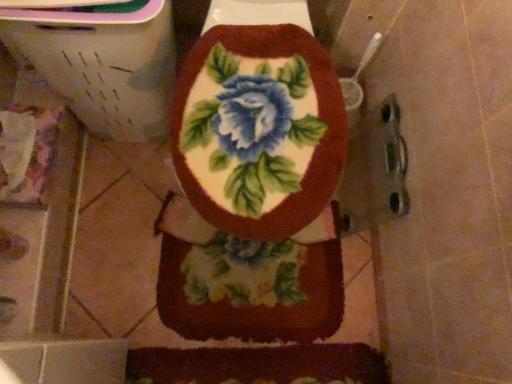
Identify the location of vacant area situated below fluffy floral rug at center (from a real-world perspective). This screenshot has height=384, width=512. (241, 295).